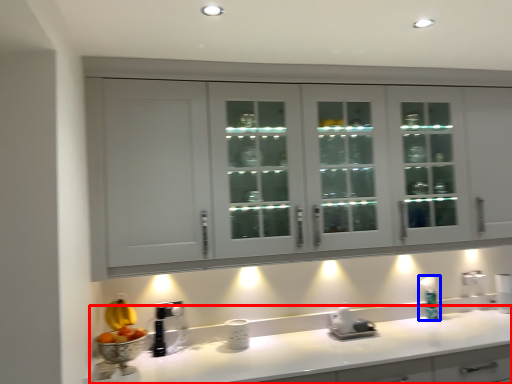
Question: Which object is closer to the camera taking this photo, countertop (highlighted by a red box) or soap dispenser (highlighted by a blue box)?

Choices:
 (A) countertop
 (B) soap dispenser

Answer: (A)